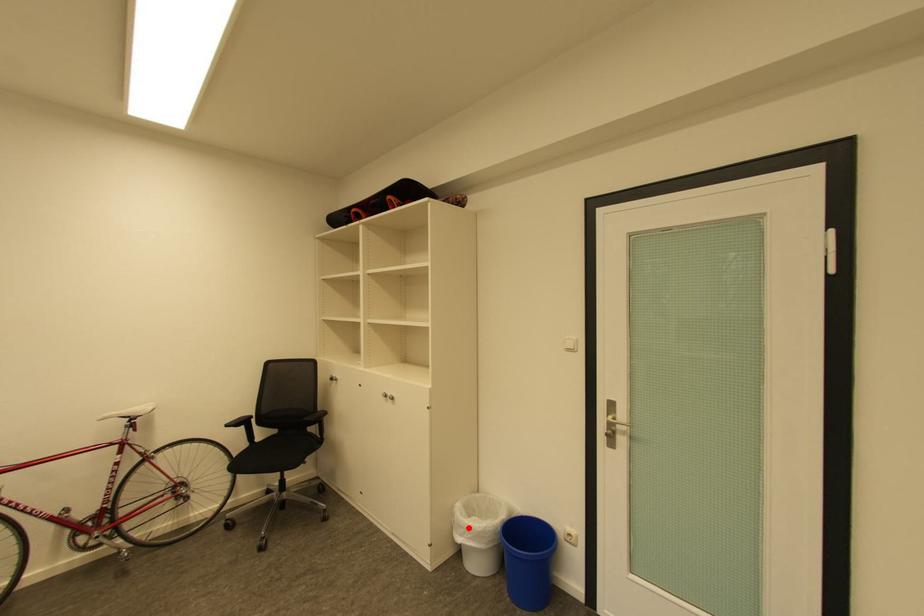
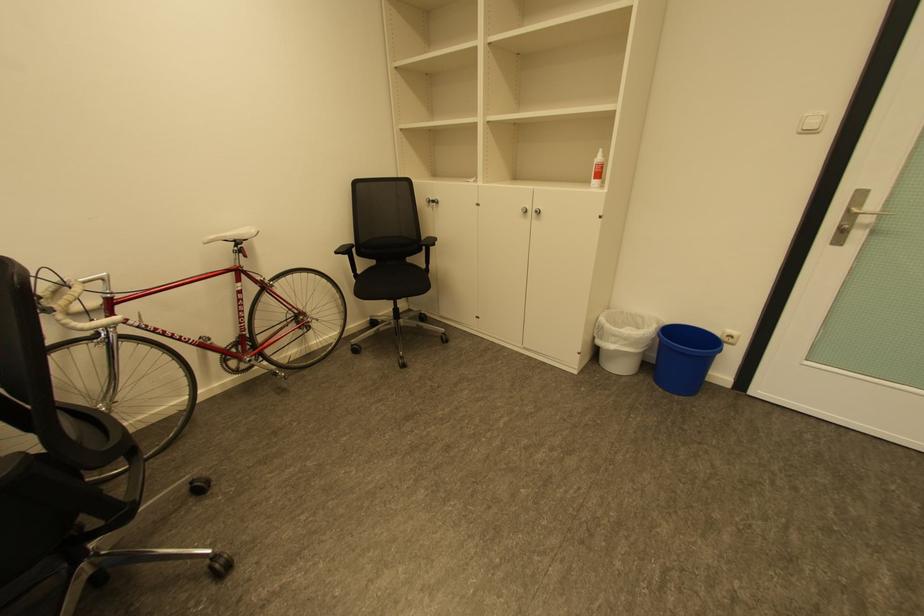
Question: I am providing you with two images of the same scene from different viewpoints. A red point is shown in image1. For the corresponding object point in image2, is it positioned nearer or farther from the camera?

Choices:
 (A) Nearer
 (B) Farther

Answer: (A)